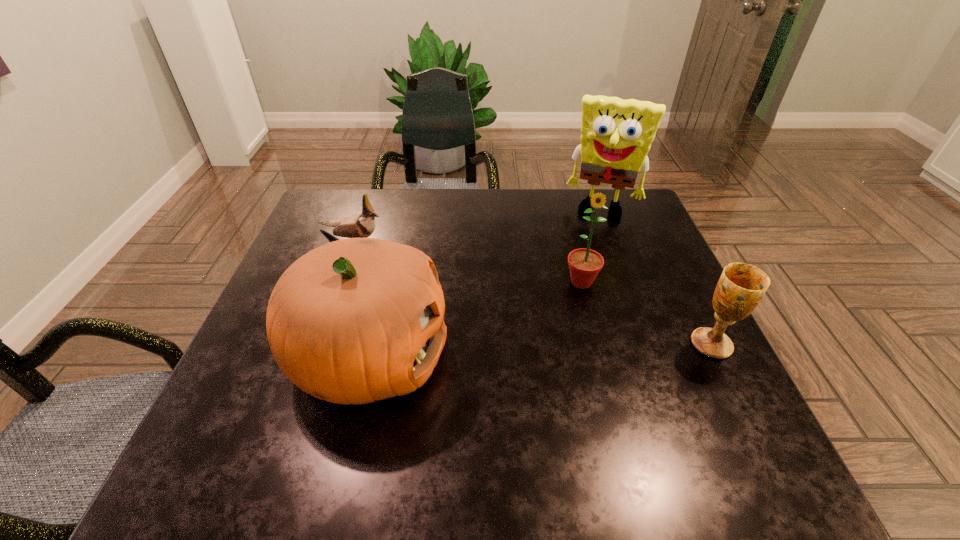
Where is `vacant region located on the face of the sunflower`? The width and height of the screenshot is (960, 540). vacant region located on the face of the sunflower is located at coordinates (564, 389).

Where is `vacant space located 0.380m on the face of the sponge`? The width and height of the screenshot is (960, 540). vacant space located 0.380m on the face of the sponge is located at coordinates (564, 314).

Image resolution: width=960 pixels, height=540 pixels. What are the coordinates of `free space located 0.380m on the face of the sponge` in the screenshot? It's located at (564, 314).

You are a GUI agent. You are given a task and a screenshot of the screen. Output one action in this format:
    pyautogui.click(x=<x>, y=<y>)
    Task: Click on the free space located 0.190m on the face of the sponge
    
    Given the screenshot: What is the action you would take?
    pyautogui.click(x=581, y=262)

Where is `vacant region located at the face of the bird`? The height and width of the screenshot is (540, 960). vacant region located at the face of the bird is located at coordinates (440, 278).

Where is `vacant area located at the face of the bird`? The image size is (960, 540). vacant area located at the face of the bird is located at coordinates (437, 276).

Locate an element on the screen. free space located at the face of the bird is located at coordinates (453, 284).

Locate an element on the screen. This screenshot has height=540, width=960. sponge at the far edge is located at coordinates (616, 135).

Find the location of a particular element. This screenshot has height=540, width=960. bird that is at the far edge is located at coordinates (362, 224).

Identify the location of object at the near edge. This screenshot has width=960, height=540. (353, 321).